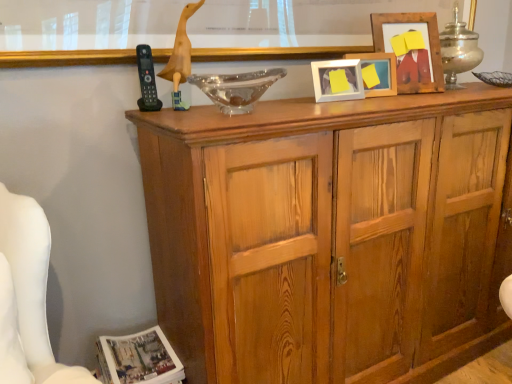
This screenshot has height=384, width=512. What are the coordinates of `free space on the front side of wooden picture frame at upper right, the 3th picture frame positioned from the left` in the screenshot? It's located at (436, 90).